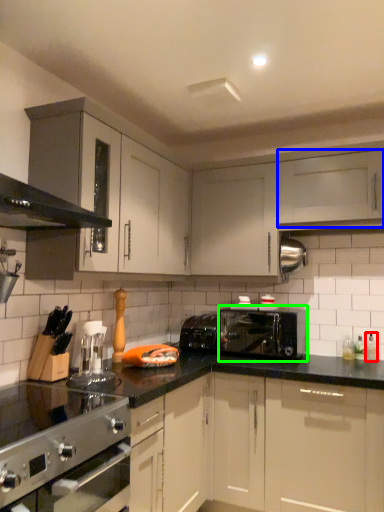
Question: Considering the real-world distances, which object is farthest from bottle (highlighted by a red box)? cabinetry (highlighted by a blue box) or toaster (highlighted by a green box)?

Choices:
 (A) cabinetry
 (B) toaster

Answer: (A)